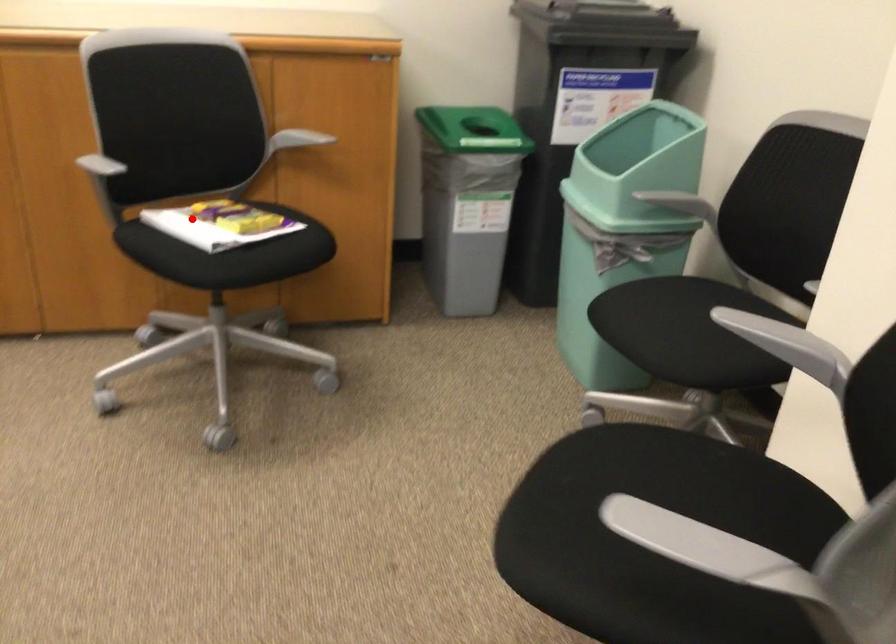
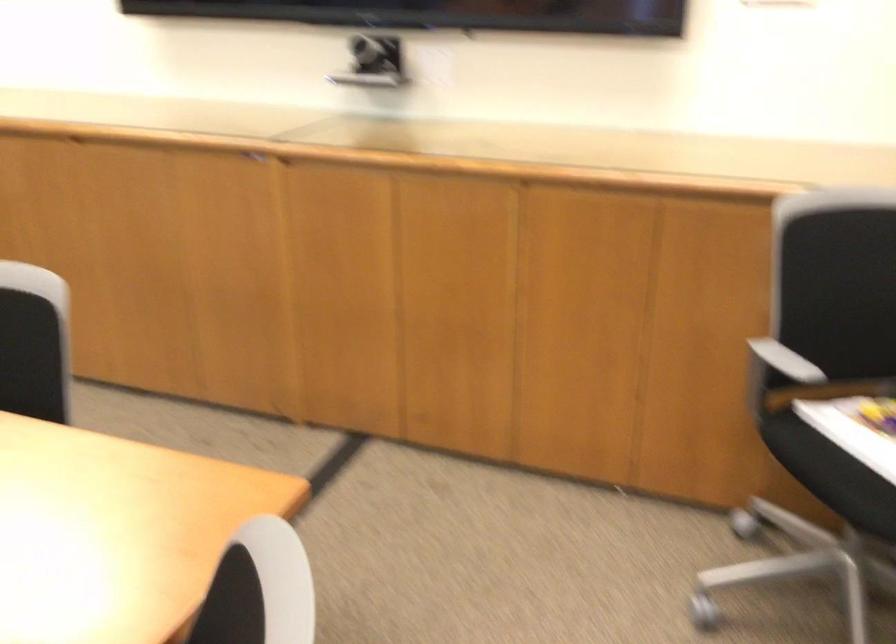
Find the pixel in the second image that matches the highlighted location in the first image.

(857, 428)